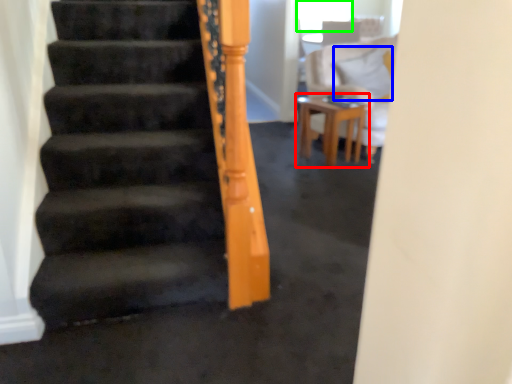
Question: Based on their relative distances, which object is nearer to table (highlighted by a red box)? Choose from pillow (highlighted by a blue box) and window screen (highlighted by a green box).

Choices:
 (A) pillow
 (B) window screen

Answer: (A)